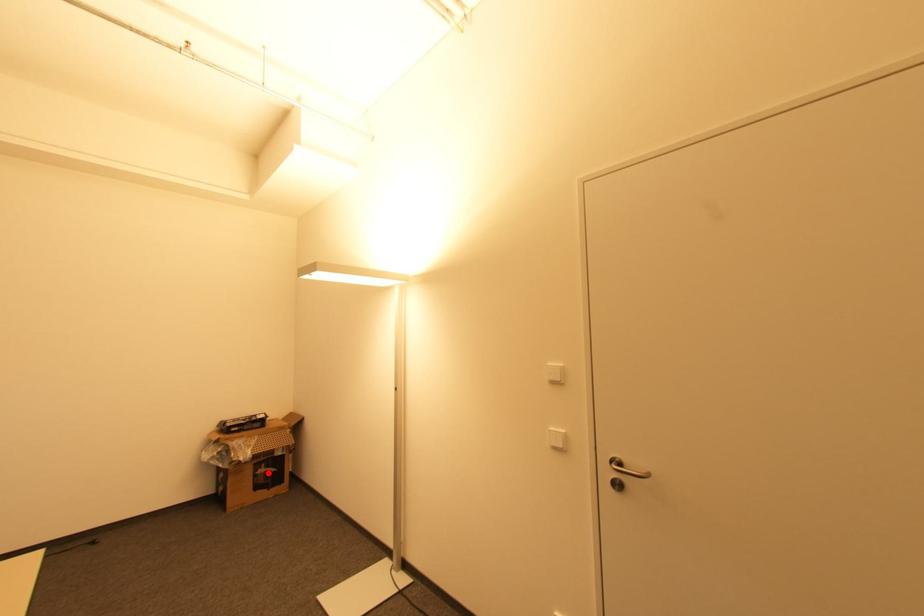
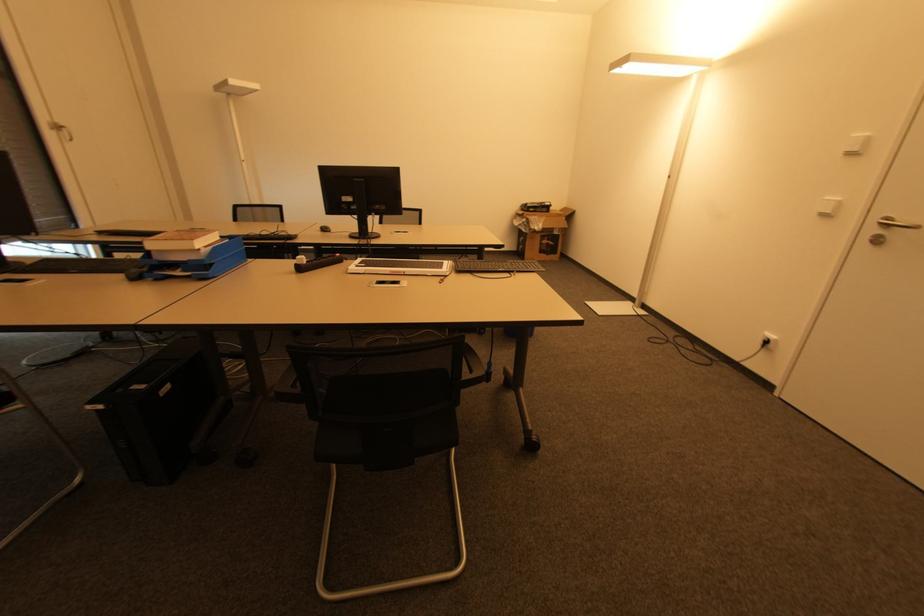
Question: I am providing you with two images of the same scene from different viewpoints. Image1 has a red point marked. In image2, the corresponding 3D location appears at what relative position? Reply with the corresponding letter.

Choices:
 (A) Closer
 (B) Farther

Answer: (A)